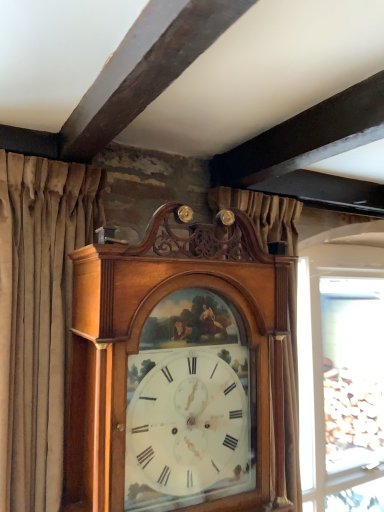
Describe the element at coordinates (183, 372) in the screenshot. I see `mahogany wood wall clock at center` at that location.

Find the location of a particular element. Image resolution: width=384 pixels, height=512 pixels. mahogany wood wall clock at center is located at coordinates (183, 372).

Where is `mahogany wood wall clock at center`? The height and width of the screenshot is (512, 384). mahogany wood wall clock at center is located at coordinates (183, 372).